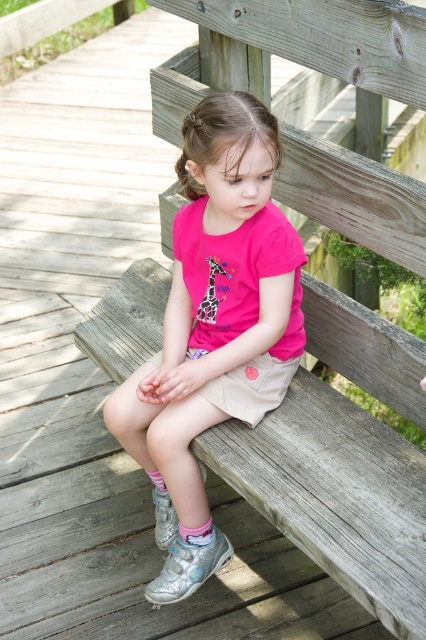
The young girl is sitting on a weathered wooden bench outdoors. She is wearing a pink matte shirt at center and has silver sneakers with colorful accents. Where is the pink matte shirt located relative to the silver sneakers?

The pink matte shirt at center is located at point (213, 326), which is centrally positioned on the girl, while the silver sneakers are on her feet below, so the shirt is above the silver sneakers.

The girl is trying to decide if her pink matte shirt at center can fit on the wooden bench at center. Based on their sizes, can the shirt fit on the bench?

The pink matte shirt at center is narrower than the wooden bench at center, so it can fit on the bench.

The young girl is sitting on the wooden bench at center. She is wearing a pink matte shirt at center. Which object is higher in the image?

The pink matte shirt at center is located above the wooden bench at center, so the pink matte shirt at center is higher.